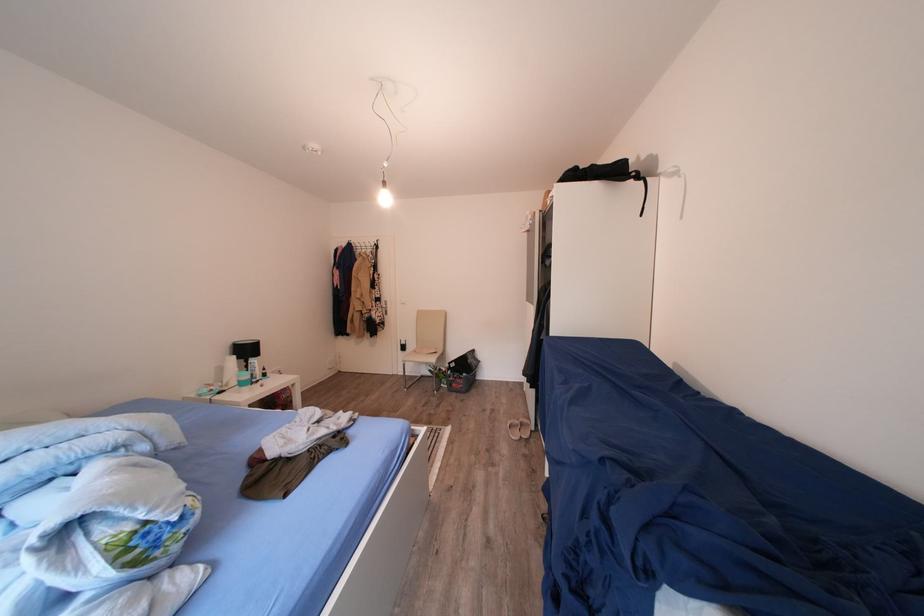
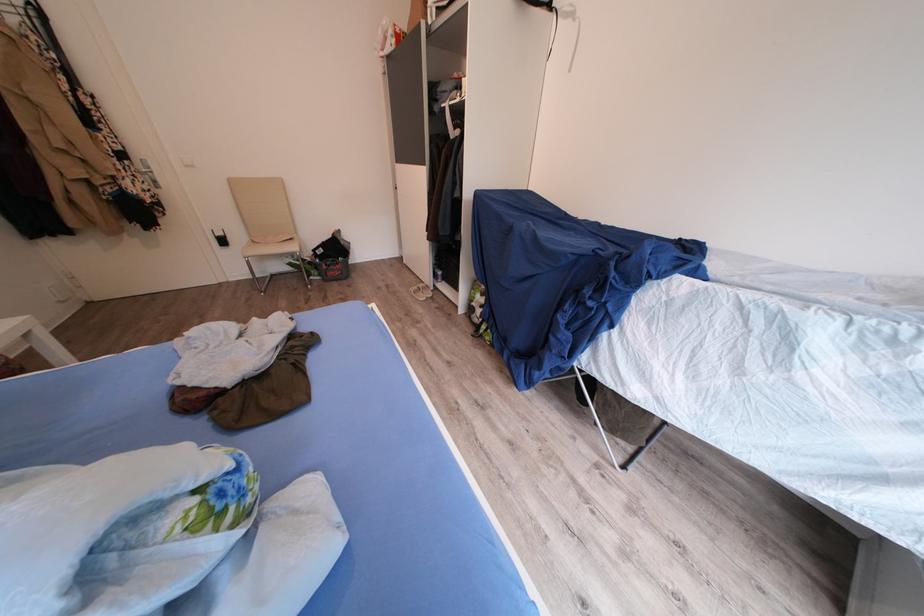
The point at (526,427) is marked in the first image. Where is the corresponding point in the second image?

(424, 293)